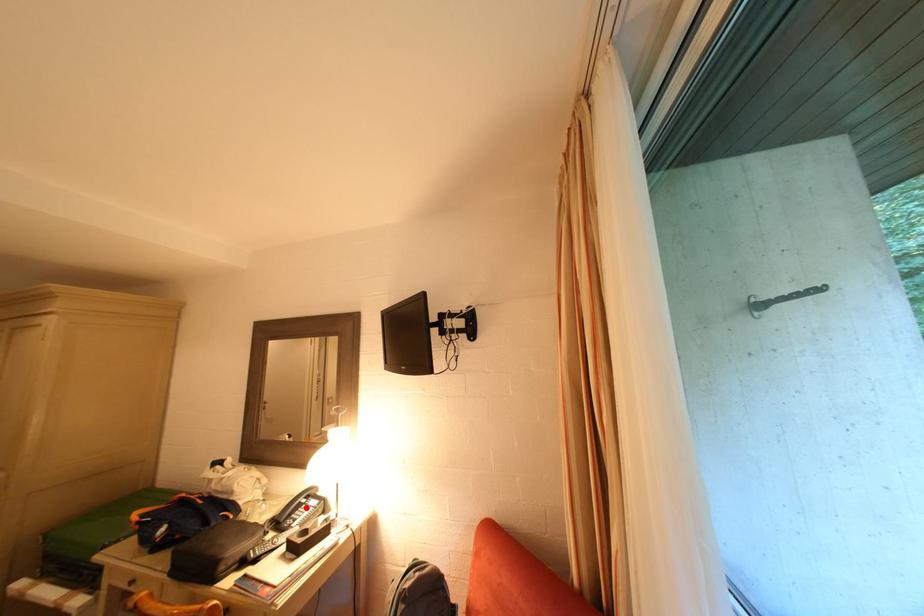
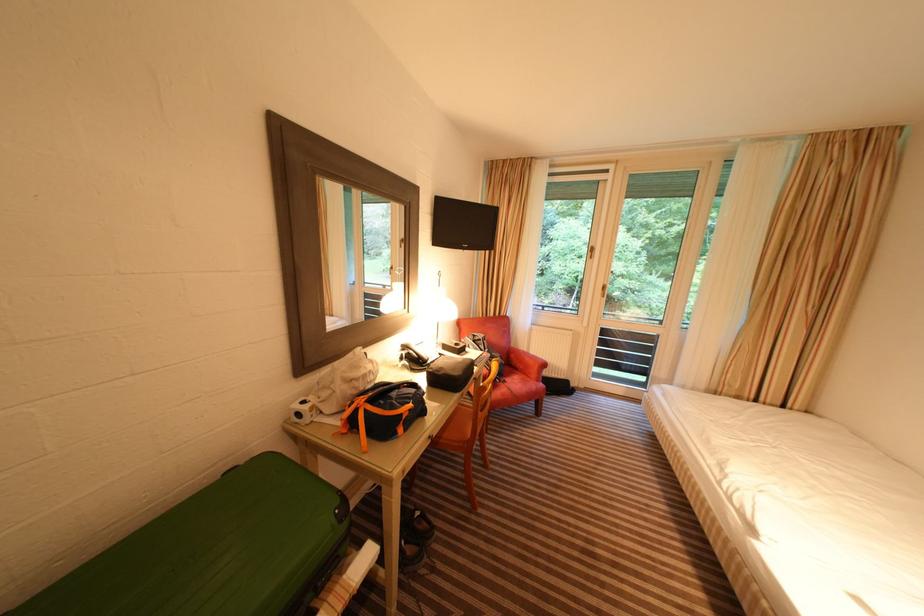
The point at the highlighted location is marked in the first image. Where is the corresponding point in the second image?

(423, 355)